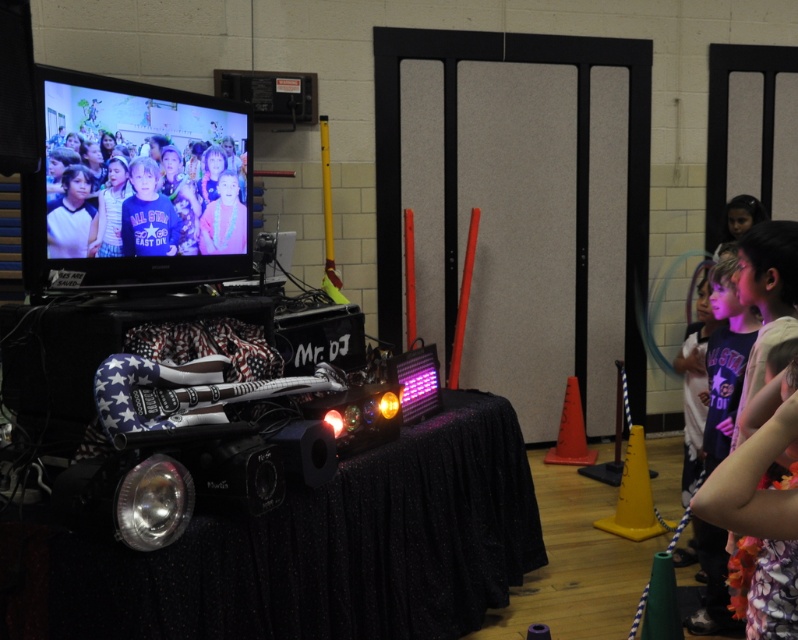
Question: Which point is farther from the camera taking this photo?

Choices:
 (A) 785,317
 (B) 85,202

Answer: (A)

Question: Which point is farther to the camera?

Choices:
 (A) (99, 195)
 (B) (769, 326)

Answer: (B)

Question: Can you confirm if matte black shirt at upper left is positioned below floral dress at right?

Choices:
 (A) yes
 (B) no

Answer: (B)

Question: Is matte black shirt at upper left smaller than floral dress at right?

Choices:
 (A) no
 (B) yes

Answer: (B)

Question: Is matte black shirt at upper left to the right of floral dress at right from the viewer's perspective?

Choices:
 (A) yes
 (B) no

Answer: (B)